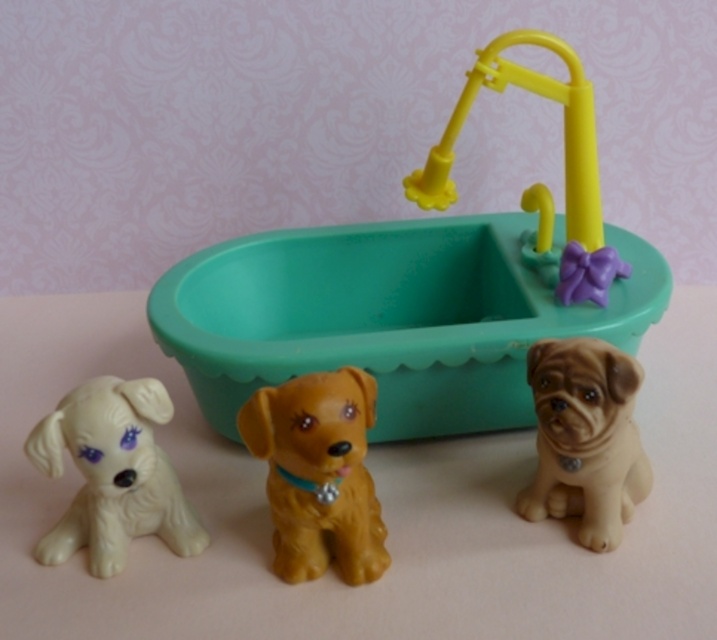
Question: Observing the image, what is the correct spatial positioning of shiny brown dog at center in reference to brown matte dog at right?

Choices:
 (A) right
 (B) left

Answer: (B)

Question: Which of the following is the closest to the observer?

Choices:
 (A) shiny brown dog at center
 (B) teal plastic bathtub at center
 (C) brown matte dog at right

Answer: (A)

Question: Which point is farther from the camera taking this photo?

Choices:
 (A) (584, 541)
 (B) (358, 452)
 (C) (455, 419)
 (D) (98, 433)

Answer: (C)

Question: Is the position of teal plastic bathtub at center less distant than that of white glossy dog at lower left?

Choices:
 (A) yes
 (B) no

Answer: (B)

Question: Is the position of teal plastic bathtub at center less distant than that of yellow plastic faucet at upper center?

Choices:
 (A) no
 (B) yes

Answer: (B)

Question: Which of the following is the closest to the observer?

Choices:
 (A) (282, 260)
 (B) (604, 342)
 (C) (322, 444)

Answer: (C)